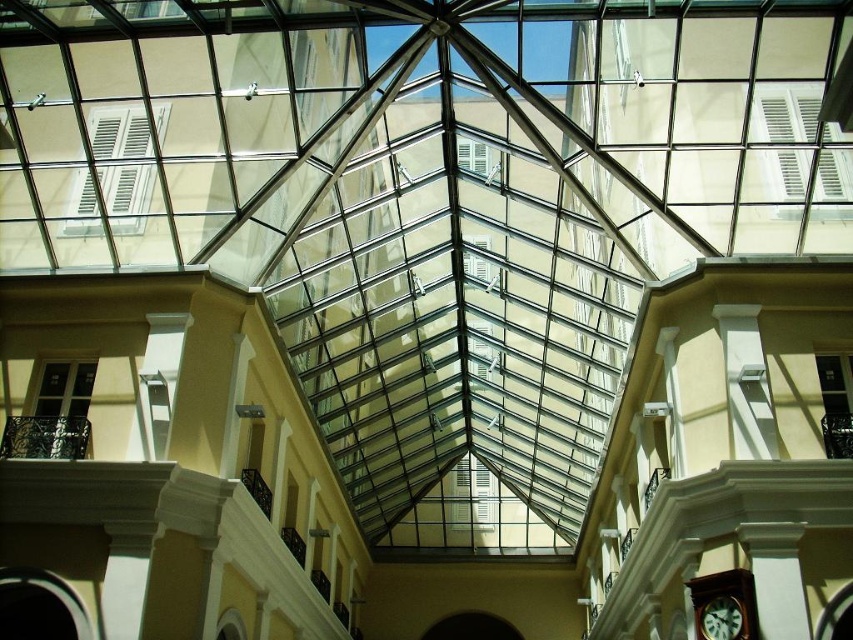
Is brown wooden clock at lower right shorter than green matte clock at lower right?

In fact, brown wooden clock at lower right may be taller than green matte clock at lower right.

Who is positioned more to the right, brown wooden clock at lower right or green matte clock at lower right?

Positioned to the right is brown wooden clock at lower right.

Measure the distance between point (711, 634) and camera.

Point (711, 634) is 98.52 feet away from camera.

Find the location of `brown wooden clock at lower right`. brown wooden clock at lower right is located at coordinates (724, 604).